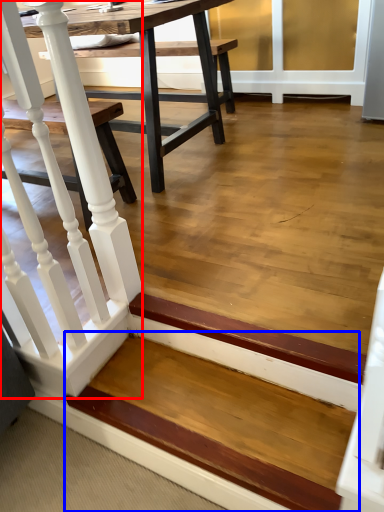
Question: Which object appears farthest to the camera in this image, rail (highlighted by a red box) or stairwell (highlighted by a blue box)?

Choices:
 (A) rail
 (B) stairwell

Answer: (B)